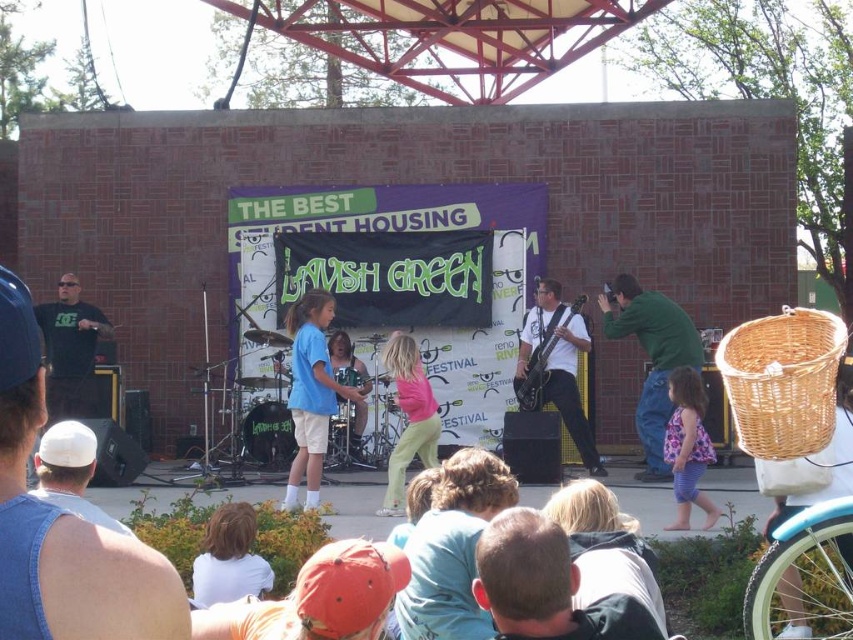
Question: Which point is closer to the camera?

Choices:
 (A) light blue t-shirt at center
 (B) matte white guitar at center
 (C) green cotton shirt at right
 (D) white fabric shirt at lower left

Answer: (D)

Question: Can you confirm if purple striped shorts at lower right is positioned above matte black guitar at center?

Choices:
 (A) no
 (B) yes

Answer: (A)

Question: Estimate the real-world distances between objects in this image. Which object is closer to the matte white guitar at center?

Choices:
 (A) green cotton shirt at right
 (B) matte pink shirt at center
 (C) denim vest at left

Answer: (A)

Question: Which of the following is the closest to the observer?

Choices:
 (A) (701, 458)
 (B) (419, 388)
 (C) (308, 496)

Answer: (A)

Question: Does green cotton shirt at right appear on the right side of matte pink shirt at center?

Choices:
 (A) no
 (B) yes

Answer: (B)

Question: Does purple striped shorts at lower right have a lesser width compared to matte black guitar at center?

Choices:
 (A) no
 (B) yes

Answer: (B)